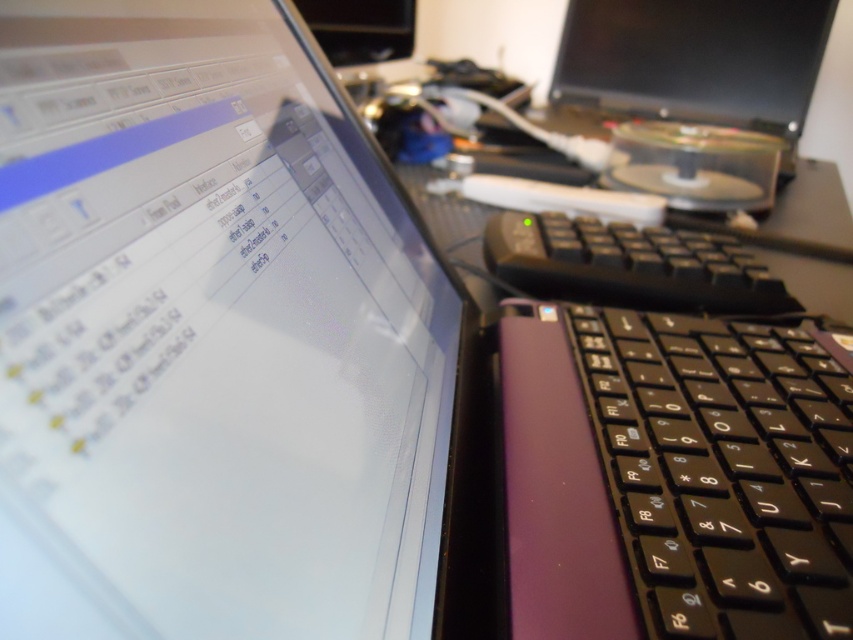
You are using a laptop and need to locate the black plastic keyboard at center. According to the coordinates provided, where exactly is it positioned on the screen?

The black plastic keyboard at center is positioned at point coordinates of (723, 470).

You are working on a laptop and need to reach the matte black monitor at upper right. Which direction should you move your hand from the black plastic keyboard at center to reach it?

The matte black monitor at upper right is on the right side of the black plastic keyboard at center, so you should move your hand to the right.

You are looking at the laptop screen and keyboard. There are two points marked on the screen at coordinates point (225,163) and point (347,54). Which point is closer to you?

Point (225,163) is closer to the viewer than point (347,54).